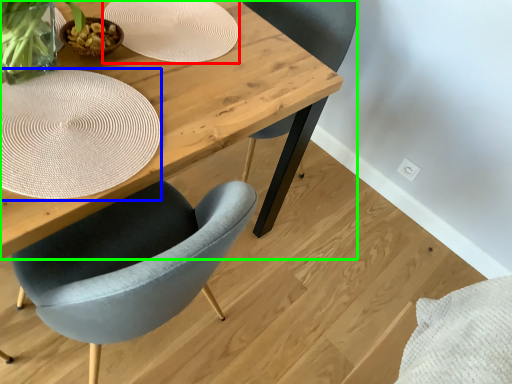
Question: Estimate the real-world distances between objects in this image. Which object is closer to paper plate (highlighted by a red box), paper plate (highlighted by a blue box) or table (highlighted by a green box)?

Choices:
 (A) paper plate
 (B) table

Answer: (B)